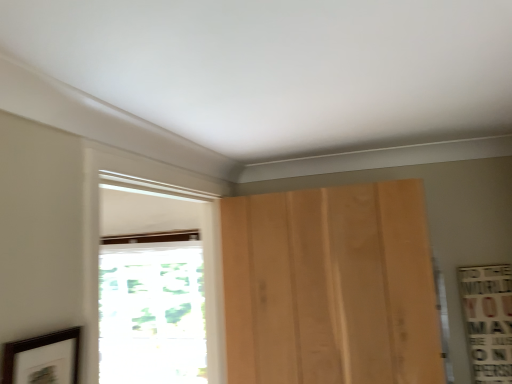
Find the location of a particular element. This screenshot has height=384, width=512. light brown wood door at center is located at coordinates (330, 286).

You are a GUI agent. You are given a task and a screenshot of the screen. Output one action in this format:
    pyautogui.click(x=<x>, y=<y>)
    Task: Click on the window below the dark brown wooden picture frame at lower left (from the image's perspective)
    This screenshot has height=384, width=512.
    Given the screenshot: What is the action you would take?
    pyautogui.click(x=152, y=313)

How different are the orientations of transparent glass window at left, which is counted as the 1th window, starting from the back, and dark brown wooden picture frame at lower left in degrees?

90.4 degrees.

From a real-world perspective, between transparent glass window at left, which appears as the second window when viewed from the front, and dark brown wooden picture frame at lower left, who is vertically lower?

transparent glass window at left, which appears as the second window when viewed from the front, is physically lower.

Is transparent glass window at left, which is counted as the 1th window, starting from the back, at the right side of dark brown wooden picture frame at lower left?

In fact, transparent glass window at left, which is counted as the 1th window, starting from the back, is to the left of dark brown wooden picture frame at lower left.

Is transparent glass window at left, which is counted as the 1th window, starting from the back, thinner than light brown wood door at center?

No, transparent glass window at left, which is counted as the 1th window, starting from the back, is not thinner than light brown wood door at center.

Between transparent glass window at left, which is counted as the 1th window, starting from the back, and light brown wood door at center, which one has smaller size?

light brown wood door at center is smaller.

Is transparent glass window at left, which appears as the second window when viewed from the front, to the left of light brown wood door at center from the viewer's perspective?

Correct, you'll find transparent glass window at left, which appears as the second window when viewed from the front, to the left of light brown wood door at center.

From a real-world perspective, is transparent glass window at left, which is counted as the 1th window, starting from the back, located higher than light brown wood door at center?

No.

Is light brown wood door at center positioned beyond the bounds of transparent glass window at left, which is counted as the 1th window, starting from the back?

Yes.

Is light brown wood door at center looking in the opposite direction of transparent glass window at left, which appears as the second window when viewed from the front?

No, light brown wood door at center is not facing the opposite direction of transparent glass window at left, which appears as the second window when viewed from the front.

Is point (231, 216) more distant than point (125, 292)?

No, (231, 216) is in front of (125, 292).

Considering the relative sizes of light brown wood door at center and transparent glass window at left, which appears as the second window when viewed from the front, in the image provided, is light brown wood door at center wider than transparent glass window at left, which appears as the second window when viewed from the front,?

No, light brown wood door at center is not wider than transparent glass window at left, which appears as the second window when viewed from the front.

Considering the relative positions of dark brown wooden picture frame at lower left and transparent glass window at left, which is counted as the 1th window, starting from the back, in the image provided, is dark brown wooden picture frame at lower left in front of transparent glass window at left, which is counted as the 1th window, starting from the back,?

Yes, dark brown wooden picture frame at lower left is in front of transparent glass window at left, which is counted as the 1th window, starting from the back.

Which object is wider, dark brown wooden picture frame at lower left or transparent glass window at left, which is counted as the 1th window, starting from the back?

With larger width is transparent glass window at left, which is counted as the 1th window, starting from the back.

Is point (79, 333) more distant than point (164, 248)?

No, it is not.

From the image's perspective, who appears lower, dark brown wooden picture frame at lower left or transparent glass window at left, which is counted as the 1th window, starting from the back?

transparent glass window at left, which is counted as the 1th window, starting from the back, appears lower in the image.

Does dark brown wooden picture frame at lower left lie in front of light brown wood door at center?

Yes, it is in front of light brown wood door at center.

Is dark brown wooden picture frame at lower left far away from light brown wood door at center?

No, dark brown wooden picture frame at lower left is not far away from light brown wood door at center.

Considering the sizes of objects dark brown wooden picture frame at lower left and light brown wood door at center in the image provided, who is thinner, dark brown wooden picture frame at lower left or light brown wood door at center?

With smaller width is dark brown wooden picture frame at lower left.

In the image, is white wood window at center, placed as the 2th window when sorted from back to front, on the left side or the right side of light brown wood door at center?

In the image, white wood window at center, placed as the 2th window when sorted from back to front, appears on the left side of light brown wood door at center.

Which is in front, white wood window at center, placed as the 2th window when sorted from back to front, or light brown wood door at center?

white wood window at center, placed as the 2th window when sorted from back to front, is in front.

From the image's perspective, is light brown wood door at center positioned above or below dark brown wooden picture frame at lower left?

From the image's perspective, light brown wood door at center appears above dark brown wooden picture frame at lower left.

Looking at this image, in terms of height, does light brown wood door at center look taller or shorter compared to dark brown wooden picture frame at lower left?

In the image, light brown wood door at center appears to be taller than dark brown wooden picture frame at lower left.

The height and width of the screenshot is (384, 512). In order to click on picture frame located in front of the light brown wood door at center in this screenshot , I will do pos(42,359).

From a real-world perspective, is light brown wood door at center physically below dark brown wooden picture frame at lower left?

No, from a real-world perspective, light brown wood door at center is not below dark brown wooden picture frame at lower left.

This screenshot has width=512, height=384. In order to click on window on the left of the dark brown wooden picture frame at lower left in this screenshot , I will do `click(152, 313)`.

Where is `door that appears above the transparent glass window at left, which appears as the second window when viewed from the front (from a real-world perspective)`? The image size is (512, 384). door that appears above the transparent glass window at left, which appears as the second window when viewed from the front (from a real-world perspective) is located at coordinates (330, 286).

Considering their positions, is white wood window at center, placed as the 2th window when sorted from back to front, positioned closer to dark brown wooden picture frame at lower left than light brown wood door at center?

The object closer to dark brown wooden picture frame at lower left is white wood window at center, placed as the 2th window when sorted from back to front.

Based on their spatial positions, is light brown wood door at center or dark brown wooden picture frame at lower left closer to white wood window at center, the first window from the front?

dark brown wooden picture frame at lower left is closer to white wood window at center, the first window from the front.

From the picture: When comparing their distances from light brown wood door at center, does transparent glass window at left, which is counted as the 1th window, starting from the back, or dark brown wooden picture frame at lower left seem closer?

Among the two, transparent glass window at left, which is counted as the 1th window, starting from the back, is located nearer to light brown wood door at center.

Estimate the real-world distances between objects in this image. Which object is further from dark brown wooden picture frame at lower left, transparent glass window at left, which is counted as the 1th window, starting from the back, or white wood window at center, the first window from the front?

transparent glass window at left, which is counted as the 1th window, starting from the back, is positioned further to the anchor dark brown wooden picture frame at lower left.

Considering their positions, is light brown wood door at center positioned closer to white wood window at center, placed as the 2th window when sorted from back to front, than transparent glass window at left, which is counted as the 1th window, starting from the back?

The object closer to white wood window at center, placed as the 2th window when sorted from back to front, is light brown wood door at center.

Estimate the real-world distances between objects in this image. Which object is further from light brown wood door at center, transparent glass window at left, which appears as the second window when viewed from the front, or white wood window at center, the first window from the front?

The object further to light brown wood door at center is transparent glass window at left, which appears as the second window when viewed from the front.

When comparing their distances from transparent glass window at left, which is counted as the 1th window, starting from the back, does white wood window at center, the first window from the front, or dark brown wooden picture frame at lower left seem closer?

white wood window at center, the first window from the front.

Looking at this image, which object lies further to the anchor point transparent glass window at left, which is counted as the 1th window, starting from the back, light brown wood door at center or dark brown wooden picture frame at lower left?

dark brown wooden picture frame at lower left lies further to transparent glass window at left, which is counted as the 1th window, starting from the back, than the other object.

Find the location of `door between white wood window at center, the first window from the front, and transparent glass window at left, which is counted as the 1th window, starting from the back, from front to back`. door between white wood window at center, the first window from the front, and transparent glass window at left, which is counted as the 1th window, starting from the back, from front to back is located at coordinates click(330, 286).

Where is `door between dark brown wooden picture frame at lower left and transparent glass window at left, which appears as the second window when viewed from the front, along the z-axis`? Image resolution: width=512 pixels, height=384 pixels. door between dark brown wooden picture frame at lower left and transparent glass window at left, which appears as the second window when viewed from the front, along the z-axis is located at coordinates (330, 286).

Where is `window between dark brown wooden picture frame at lower left and transparent glass window at left, which appears as the second window when viewed from the front, in the front-back direction`? The width and height of the screenshot is (512, 384). window between dark brown wooden picture frame at lower left and transparent glass window at left, which appears as the second window when viewed from the front, in the front-back direction is located at coordinates (99, 228).

Where is `window between dark brown wooden picture frame at lower left and light brown wood door at center from left to right`? The height and width of the screenshot is (384, 512). window between dark brown wooden picture frame at lower left and light brown wood door at center from left to right is located at coordinates (99, 228).